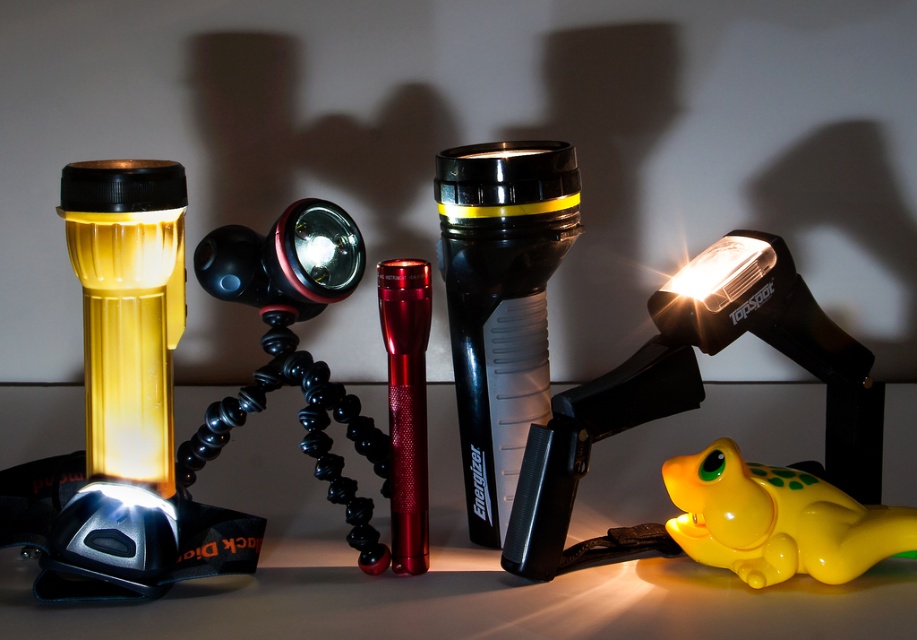
Question: Which object is farther from the camera taking this photo?

Choices:
 (A) black plastic flashlight at center
 (B) yellow glossy toy frog at lower right

Answer: (A)

Question: Is the position of yellow matte flashlight at left less distant than that of yellow glossy toy frog at lower right?

Choices:
 (A) no
 (B) yes

Answer: (B)

Question: Which point is farther to the camera?

Choices:
 (A) (257, 406)
 (B) (543, 396)
 (C) (558, 426)

Answer: (B)

Question: Can you confirm if yellow matte flashlight at left is positioned above yellow glossy toy frog at lower right?

Choices:
 (A) no
 (B) yes

Answer: (B)

Question: Estimate the real-world distances between objects in this image. Which object is farther from the yellow glossy toy frog at lower right?

Choices:
 (A) metallic red flashlight at center
 (B) black flexible tripod at center
 (C) black plastic flashlight at center

Answer: (B)

Question: Is black flexible tripod at center positioned in front of metallic red flashlight at center?

Choices:
 (A) no
 (B) yes

Answer: (A)